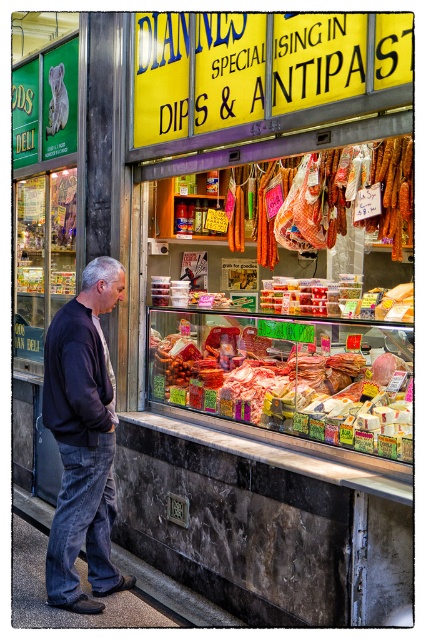
Between dark blue jeans at lower left and transparent glass display case at center, which one appears on the right side from the viewer's perspective?

dark blue jeans at lower left

Does point (80, 291) come farther from viewer compared to point (43, 216)?

That is False.

Where is `dark blue jeans at lower left`? This screenshot has height=640, width=426. dark blue jeans at lower left is located at coordinates (83, 440).

Does meaty red at center have a greater height compared to dark blue jeans at lower left?

No.

Can you confirm if meaty red at center is smaller than dark blue jeans at lower left?

Incorrect, meaty red at center is not smaller in size than dark blue jeans at lower left.

Does point (226, 403) lie behind point (86, 426)?

Yes, it is.

You are a GUI agent. You are given a task and a screenshot of the screen. Output one action in this format:
    pyautogui.click(x=<x>, y=<y>)
    Task: Click on the meaty red at center
    The image size is (426, 640).
    Given the screenshot: What is the action you would take?
    pyautogui.click(x=284, y=381)

Can you confirm if meaty red at center is smaller than transparent glass display case at center?

No, meaty red at center is not smaller than transparent glass display case at center.

Is point (365, 380) in front of point (51, 248)?

Yes, it is in front of point (51, 248).

The image size is (426, 640). Identify the location of meaty red at center. (284, 381).